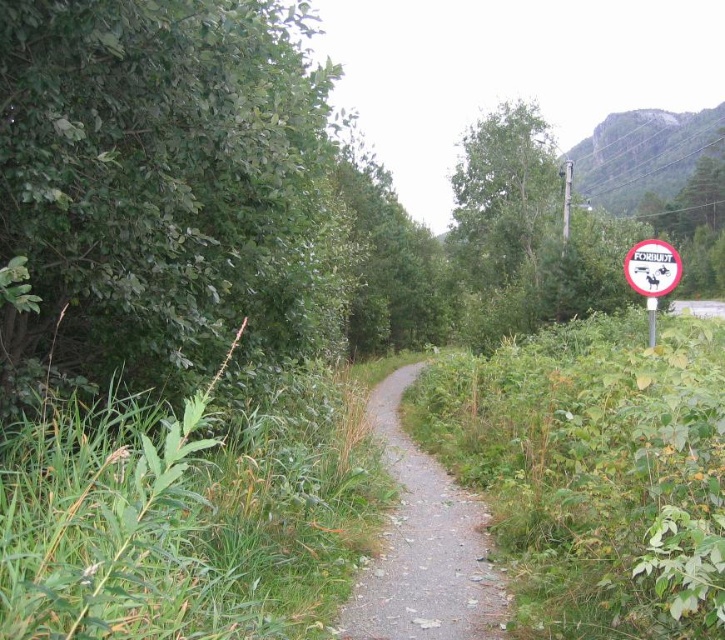
Which is more to the left, gray gravel path at center or green leafy tree at center?

Positioned to the left is gray gravel path at center.

Which is below, gray gravel path at center or green leafy tree at center?

gray gravel path at center is below.

Where is `gray gravel path at center`? Image resolution: width=725 pixels, height=640 pixels. gray gravel path at center is located at coordinates (423, 545).

You are a GUI agent. You are given a task and a screenshot of the screen. Output one action in this format:
    pyautogui.click(x=<x>, y=<y>)
    Task: Click on the gray gravel path at center
    The width and height of the screenshot is (725, 640).
    Given the screenshot: What is the action you would take?
    423,545

Between green leafy tree at left and white plastic sign at right, which one is positioned higher?

green leafy tree at left

Looking at this image, between green leafy tree at left and white plastic sign at right, which one has less height?

With less height is white plastic sign at right.

This screenshot has height=640, width=725. I want to click on green leafy tree at left, so click(x=161, y=188).

Does green leafy tree at left have a lesser width compared to green leafy tree at center?

Correct, green leafy tree at left's width is less than green leafy tree at center's.

Between green leafy tree at left and green leafy tree at center, which one is positioned higher?

green leafy tree at center

Is point (33, 230) positioned after point (529, 321)?

No, it is not.

Identify the location of green leafy tree at left. Image resolution: width=725 pixels, height=640 pixels. (161, 188).